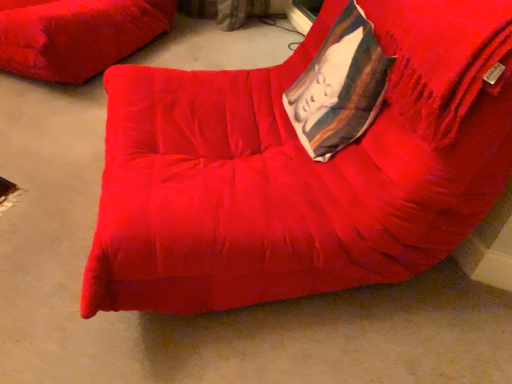
Question: Is velvet red cushion at upper left, which is counted as the 2th furniture, starting from the right, facing away from velvet-like white pillow at upper right?

Choices:
 (A) no
 (B) yes

Answer: (A)

Question: Can you confirm if velvet red cushion at upper left, which is counted as the 2th furniture, starting from the right, is shorter than velvet-like white pillow at upper right?

Choices:
 (A) no
 (B) yes

Answer: (A)

Question: Is velvet red cushion at upper left, arranged as the 1th furniture when viewed from the back, completely or partially outside of velvet-like white pillow at upper right?

Choices:
 (A) no
 (B) yes

Answer: (B)

Question: Is velvet red cushion at upper left, which appears as the first furniture when viewed from the left, thinner than velvet-like white pillow at upper right?

Choices:
 (A) yes
 (B) no

Answer: (B)

Question: From the image's perspective, would you say velvet red cushion at upper left, which appears as the first furniture when viewed from the left, is shown under velvet-like white pillow at upper right?

Choices:
 (A) yes
 (B) no

Answer: (B)

Question: Considering the relative sizes of velvet red cushion at upper left, which appears as the first furniture when viewed from the left, and velvet-like white pillow at upper right in the image provided, is velvet red cushion at upper left, which appears as the first furniture when viewed from the left, taller than velvet-like white pillow at upper right?

Choices:
 (A) yes
 (B) no

Answer: (A)

Question: Is velvet-like white pillow at upper right to the right of velvet red bean bag chair at center, the 2th furniture in the back-to-front sequence, from the viewer's perspective?

Choices:
 (A) no
 (B) yes

Answer: (B)

Question: Is velvet-like white pillow at upper right thinner than velvet red bean bag chair at center, which is counted as the 1th furniture, starting from the right?

Choices:
 (A) no
 (B) yes

Answer: (B)

Question: From a real-world perspective, is velvet-like white pillow at upper right physically below velvet red bean bag chair at center, the 2th furniture in the back-to-front sequence?

Choices:
 (A) yes
 (B) no

Answer: (B)

Question: Can you confirm if velvet-like white pillow at upper right is positioned to the left of velvet red bean bag chair at center, the 2th furniture in the back-to-front sequence?

Choices:
 (A) yes
 (B) no

Answer: (B)

Question: Is velvet-like white pillow at upper right oriented towards velvet red bean bag chair at center, which is counted as the 1th furniture, starting from the right?

Choices:
 (A) yes
 (B) no

Answer: (A)

Question: Does velvet-like white pillow at upper right have a larger size compared to velvet red bean bag chair at center, which is counted as the 1th furniture, starting from the right?

Choices:
 (A) yes
 (B) no

Answer: (B)

Question: Can you see velvet red cushion at upper left, which appears as the 2th furniture when viewed from the front, touching velvet red bean bag chair at center, marked as the 2th furniture in a left-to-right arrangement?

Choices:
 (A) no
 (B) yes

Answer: (A)